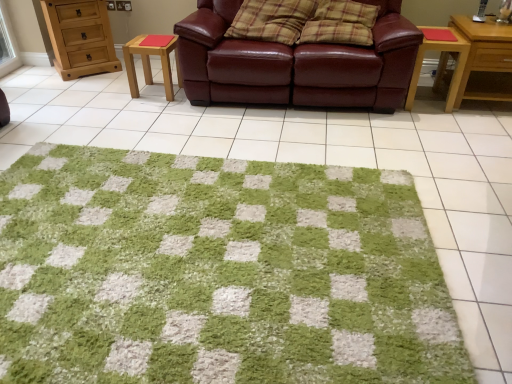
Question: Does green shaggy rug at center have a smaller size compared to plaid fabric pillow at center, placed as the second pillow when sorted from right to left?

Choices:
 (A) yes
 (B) no

Answer: (B)

Question: Does green shaggy rug at center have a lesser height compared to plaid fabric pillow at center, which is counted as the 1th pillow, starting from the left?

Choices:
 (A) yes
 (B) no

Answer: (A)

Question: Can plaid fabric pillow at center, which is counted as the 1th pillow, starting from the left, be found inside green shaggy rug at center?

Choices:
 (A) no
 (B) yes

Answer: (A)

Question: Can you confirm if green shaggy rug at center is taller than plaid fabric pillow at center, which is counted as the 1th pillow, starting from the left?

Choices:
 (A) no
 (B) yes

Answer: (A)

Question: Is green shaggy rug at center bigger than plaid fabric pillow at center, which is counted as the 1th pillow, starting from the left?

Choices:
 (A) no
 (B) yes

Answer: (B)

Question: Is green shaggy rug at center wider than plaid fabric pillow at center, placed as the second pillow when sorted from right to left?

Choices:
 (A) yes
 (B) no

Answer: (A)

Question: Is plaid fabric pillow at center, placed as the second pillow when sorted from right to left, located within wooden stool at center-left, the first table positioned from the left?

Choices:
 (A) yes
 (B) no

Answer: (B)

Question: Is wooden stool at center-left, the first table positioned from the left, oriented away from plaid fabric pillow at center, placed as the second pillow when sorted from right to left?

Choices:
 (A) yes
 (B) no

Answer: (B)

Question: Can you confirm if wooden stool at center-left, the first table positioned from the left, is wider than plaid fabric pillow at center, which is counted as the 1th pillow, starting from the left?

Choices:
 (A) yes
 (B) no

Answer: (B)

Question: Is wooden stool at center-left, the 2th table from the right, thinner than plaid fabric pillow at center, placed as the second pillow when sorted from right to left?

Choices:
 (A) yes
 (B) no

Answer: (A)

Question: Can you confirm if wooden stool at center-left, the 2th table from the right, is taller than plaid fabric pillow at center, placed as the second pillow when sorted from right to left?

Choices:
 (A) no
 (B) yes

Answer: (A)

Question: Is wooden stool at center-left, the first table positioned from the left, in contact with plaid fabric pillow at center, placed as the second pillow when sorted from right to left?

Choices:
 (A) yes
 (B) no

Answer: (B)

Question: Is leather couch at center smaller than wooden stool at center-left, the 2th table from the right?

Choices:
 (A) no
 (B) yes

Answer: (A)